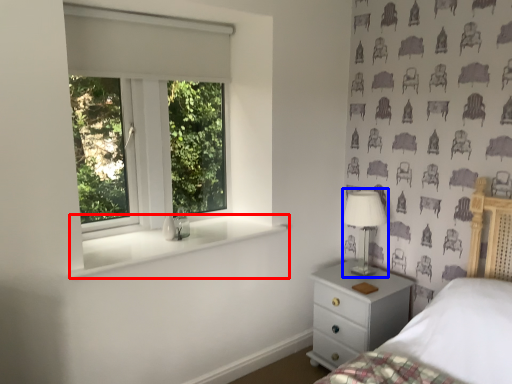
Question: Which object is closer to the camera taking this photo, window sill (highlighted by a red box) or table lamp (highlighted by a blue box)?

Choices:
 (A) window sill
 (B) table lamp

Answer: (A)